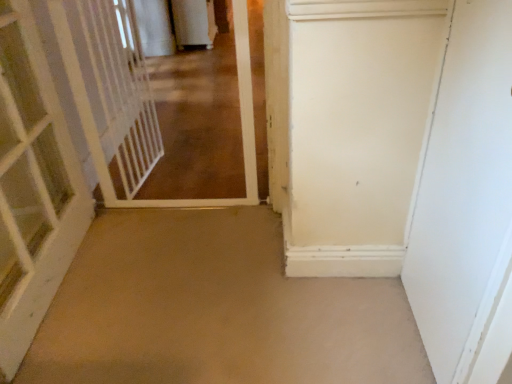
Question: Is white matte door at right, which is the first door from right to left, in contact with white plastic gate at left?

Choices:
 (A) no
 (B) yes

Answer: (A)

Question: Can you confirm if white matte door at right, which is the first door from right to left, is smaller than white plastic gate at left?

Choices:
 (A) no
 (B) yes

Answer: (A)

Question: Is white matte door at right, which is the first door from right to left, to the right of white plastic gate at left from the viewer's perspective?

Choices:
 (A) yes
 (B) no

Answer: (A)

Question: From a real-world perspective, is white matte door at right, which is counted as the second door, starting from the left, located higher than white plastic gate at left?

Choices:
 (A) yes
 (B) no

Answer: (A)

Question: Could you tell me if white matte door at right, which is counted as the second door, starting from the left, is facing white plastic gate at left?

Choices:
 (A) yes
 (B) no

Answer: (B)

Question: Is white plastic gate at left situated inside white glossy gate at upper left or outside?

Choices:
 (A) inside
 (B) outside

Answer: (B)

Question: From the image's perspective, is white plastic gate at left located above or below white glossy gate at upper left?

Choices:
 (A) below
 (B) above

Answer: (B)

Question: Considering the positions of white plastic gate at left and white glossy gate at upper left in the image, is white plastic gate at left bigger or smaller than white glossy gate at upper left?

Choices:
 (A) small
 (B) big

Answer: (A)

Question: Looking at their shapes, would you say white plastic gate at left is wider or thinner than white glossy gate at upper left?

Choices:
 (A) thin
 (B) wide

Answer: (A)

Question: Is point (506, 223) positioned closer to the camera than point (359, 360)?

Choices:
 (A) farther
 (B) closer

Answer: (B)

Question: From the image's perspective, is white matte door at right, which is the first door from right to left, located above or below beige carpet at center?

Choices:
 (A) below
 (B) above

Answer: (B)

Question: Is white matte door at right, which is counted as the second door, starting from the left, bigger or smaller than beige carpet at center?

Choices:
 (A) small
 (B) big

Answer: (A)

Question: Is white matte door at right, which is counted as the second door, starting from the left, to the left or to the right of beige carpet at center in the image?

Choices:
 (A) right
 (B) left

Answer: (A)

Question: Choose the correct answer: Is beige carpet at center inside white plastic gate at left or outside it?

Choices:
 (A) inside
 (B) outside

Answer: (B)

Question: Based on their positions, is beige carpet at center located to the left or right of white plastic gate at left?

Choices:
 (A) right
 (B) left

Answer: (A)